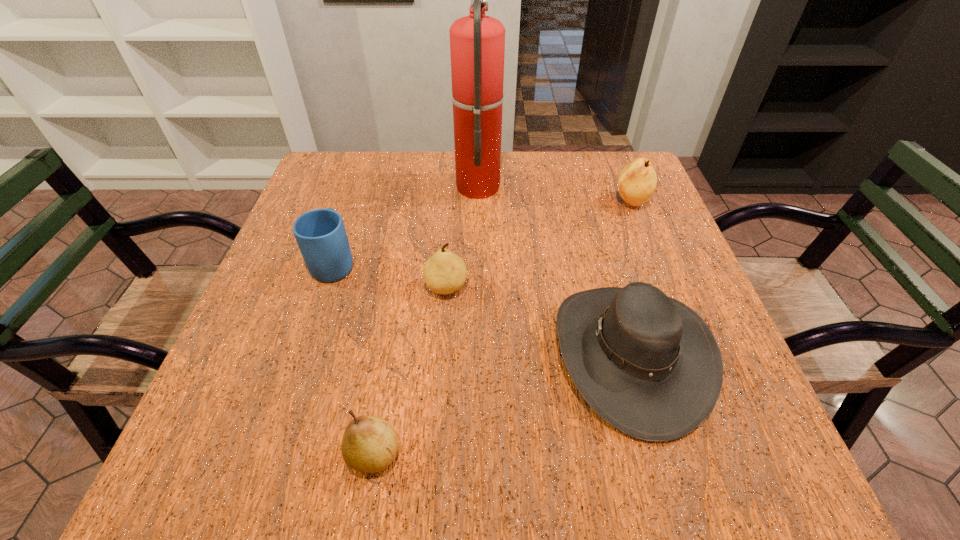
Find the location of a particular element. The image size is (960, 540). pear located at the near edge is located at coordinates (369, 444).

Image resolution: width=960 pixels, height=540 pixels. Find the location of `object present at the left edge`. object present at the left edge is located at coordinates (320, 234).

Where is `pear at the right edge`? pear at the right edge is located at coordinates (637, 181).

In order to click on cowboy hat that is at the right edge in this screenshot , I will do `click(646, 363)`.

Where is `object that is at the far right corner`? object that is at the far right corner is located at coordinates [x=637, y=181].

In order to click on object present at the near right corner in this screenshot , I will do `click(646, 363)`.

You are a GUI agent. You are given a task and a screenshot of the screen. Output one action in this format:
    pyautogui.click(x=<x>, y=<y>)
    Task: Click on the free space at the far edge of the desktop
    The height and width of the screenshot is (540, 960).
    Given the screenshot: What is the action you would take?
    pyautogui.click(x=444, y=159)

Locate an element on the screen. free space at the left edge of the desktop is located at coordinates (241, 377).

The width and height of the screenshot is (960, 540). I want to click on free space at the right edge, so click(x=639, y=225).

Where is `vacant point at the far left corner`? This screenshot has height=540, width=960. vacant point at the far left corner is located at coordinates (347, 175).